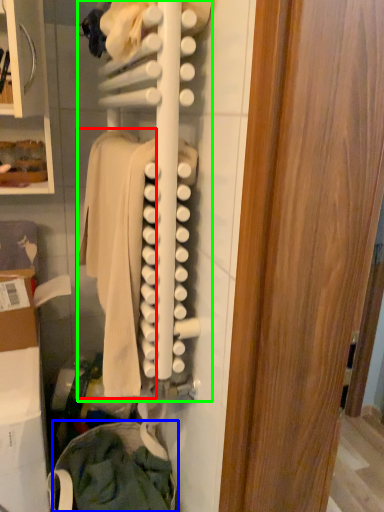
Question: Based on their relative distances, which object is farther from clothing (highlighted by a red box)? Choose from clothing (highlighted by a blue box) and closet (highlighted by a green box).

Choices:
 (A) clothing
 (B) closet

Answer: (A)